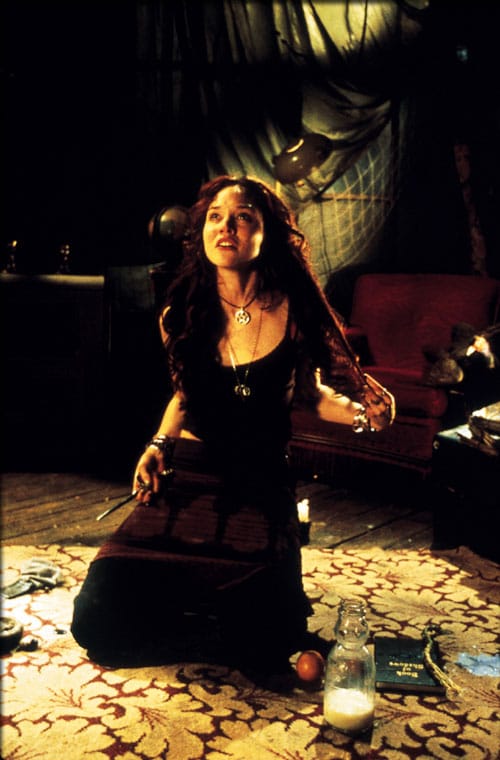
At what (x,y) coordinates should I click in order to perform the action: click on glass jar. Please return your answer as a coordinate pair (x, y). Looking at the image, I should click on (354, 663).